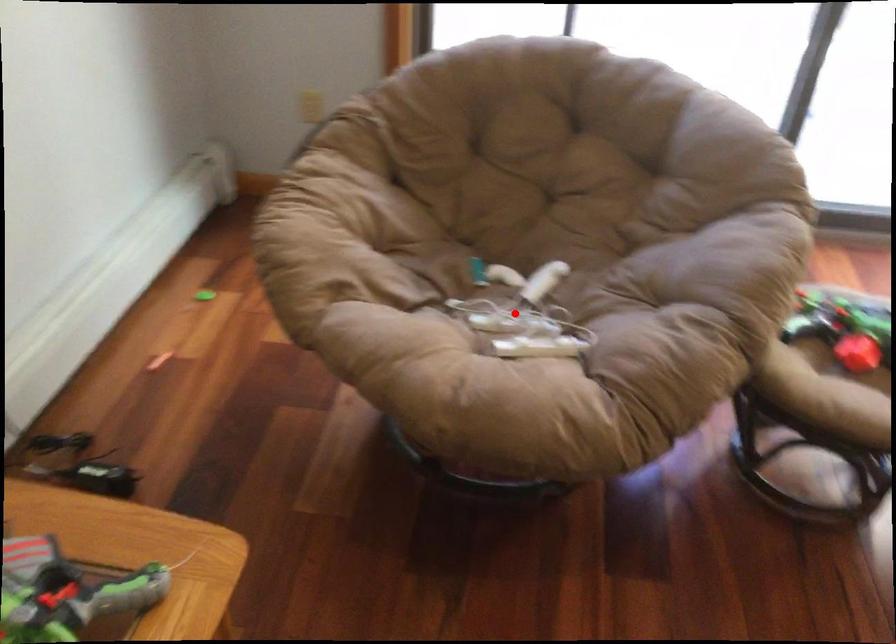
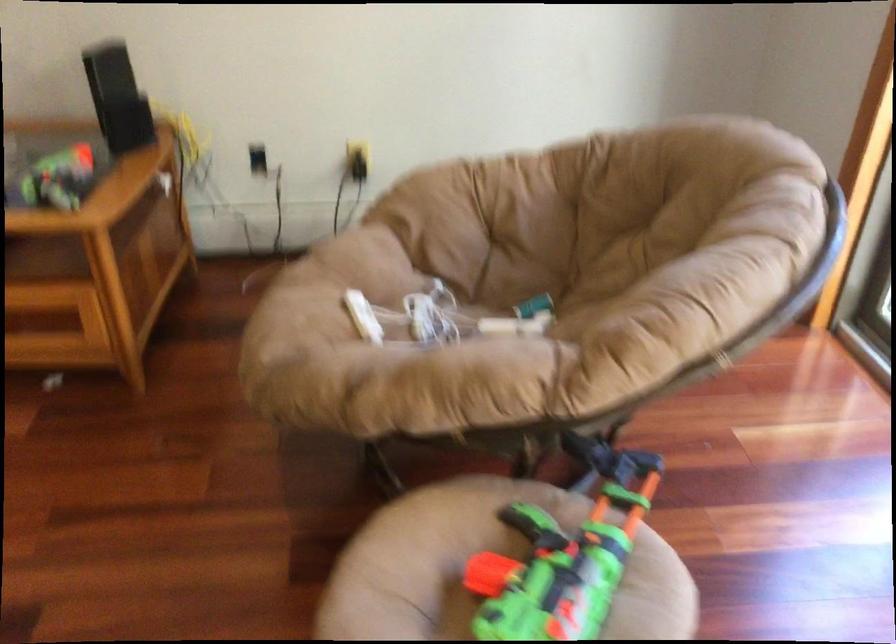
Where in the second image is the point corresponding to the highlighted location from the first image?

(442, 317)